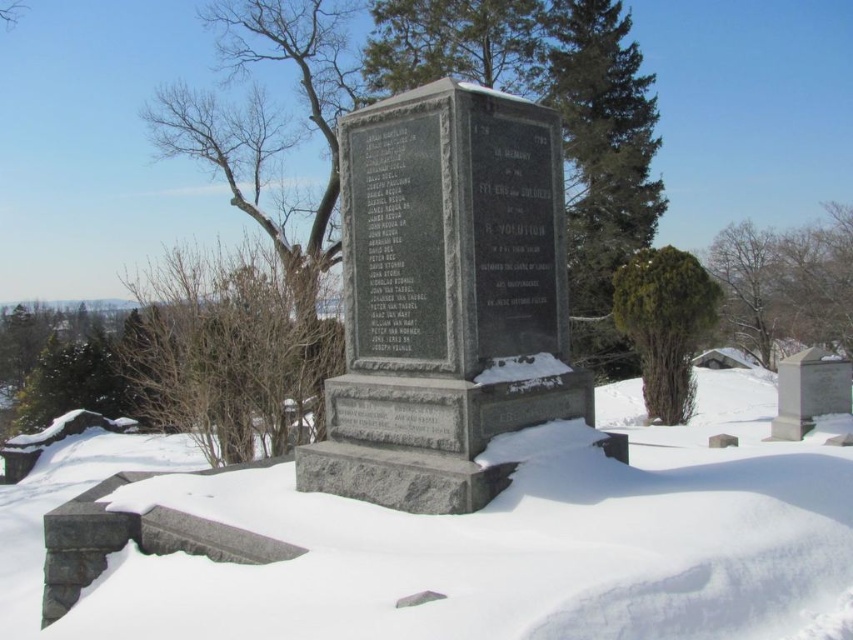
Question: Can you confirm if bare branches at lower left is positioned above green textured bush at right?

Choices:
 (A) no
 (B) yes

Answer: (A)

Question: Among these points, which one is nearest to the camera?

Choices:
 (A) pyautogui.click(x=463, y=92)
 (B) pyautogui.click(x=639, y=257)

Answer: (A)

Question: Which object is positioned closest to the granite stone monument at center?

Choices:
 (A) bare branches at lower left
 (B) green textured evergreen tree at upper right
 (C) white powdery snow at center
 (D) green leafy tree at upper right

Answer: (C)

Question: Does bare branches at lower left appear over green textured bush at right?

Choices:
 (A) no
 (B) yes

Answer: (A)

Question: Does granite stone monument at center appear on the left side of green textured evergreen tree at upper right?

Choices:
 (A) yes
 (B) no

Answer: (A)

Question: Which point is closer to the camera taking this photo?

Choices:
 (A) (663, 364)
 (B) (55, 451)
 (C) (413, 468)
 (D) (798, 276)

Answer: (C)